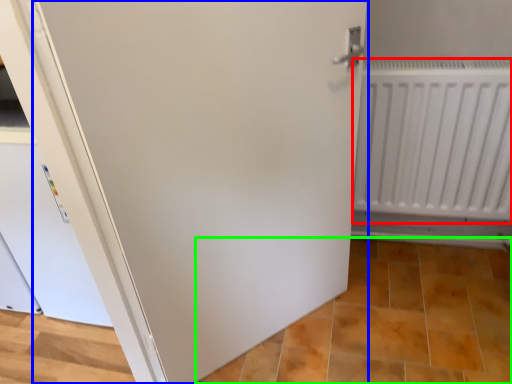
Question: Estimate the real-world distances between objects in this image. Which object is closer to radiator (highlighted by a red box), door (highlighted by a blue box) or tile (highlighted by a green box)?

Choices:
 (A) door
 (B) tile

Answer: (A)